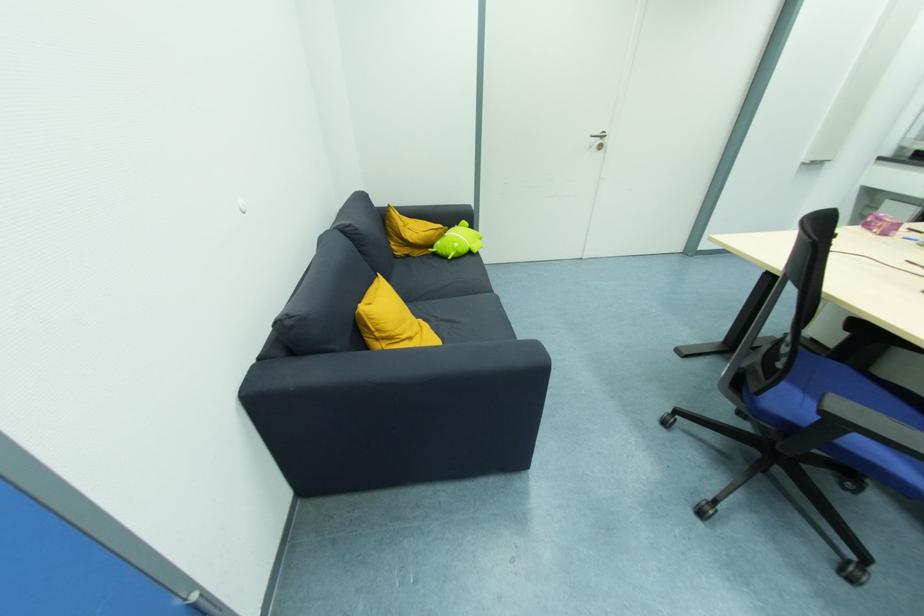
I want to click on white door handle, so click(x=599, y=140).